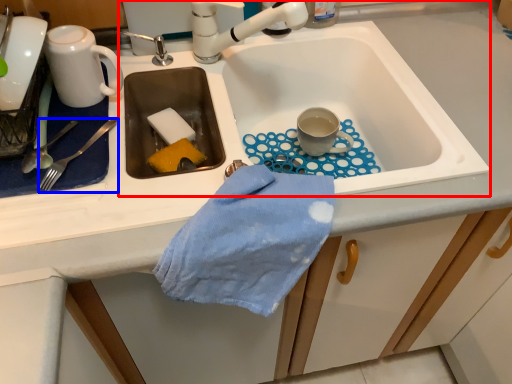
Question: Which point is closer to the camera, sink (highlighted by a red box) or silverware (highlighted by a blue box)?

Choices:
 (A) sink
 (B) silverware

Answer: (B)